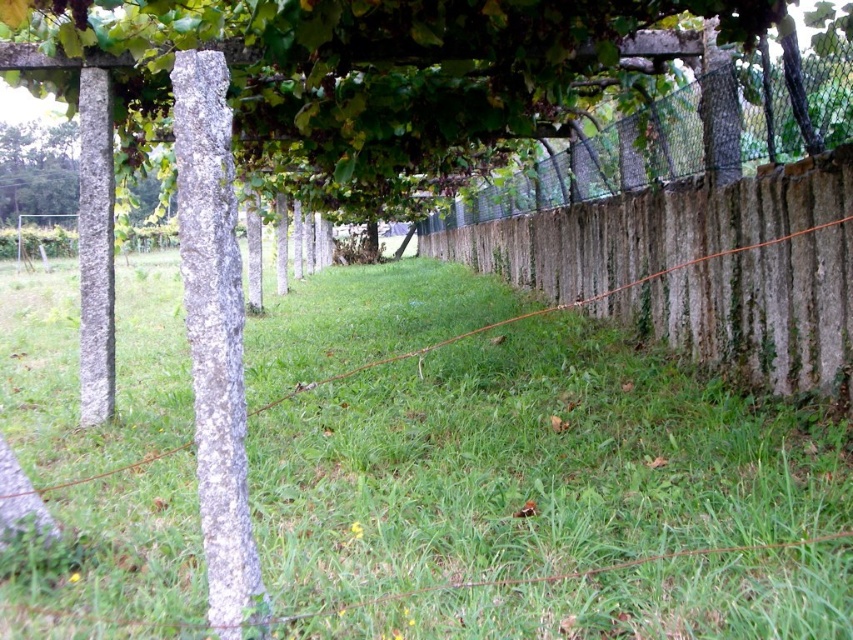
Question: Among these points, which one is farthest from the camera?

Choices:
 (A) (651, 417)
 (B) (741, 116)
 (C) (654, 154)

Answer: (C)

Question: Which point is closer to the camera?

Choices:
 (A) click(827, 572)
 (B) click(566, 72)
 (C) click(730, 148)

Answer: (A)

Question: Where is green grass at center located in relation to green leafy tree at upper center in the image?

Choices:
 (A) below
 (B) above

Answer: (A)

Question: Which point is farther to the camera?

Choices:
 (A) rustic wooden fence at center
 (B) green leafy tree at upper center

Answer: (A)

Question: Is green leafy tree at upper center above rustic wooden fence at center?

Choices:
 (A) yes
 (B) no

Answer: (B)

Question: In this image, where is green leafy tree at upper center located relative to rustic wooden fence at center?

Choices:
 (A) below
 (B) above

Answer: (A)